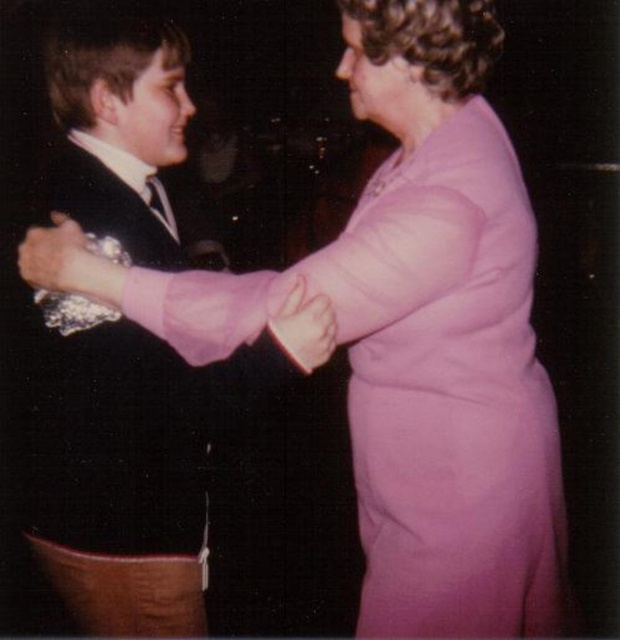
Where is `black satin suit at left`? Image resolution: width=620 pixels, height=640 pixels. black satin suit at left is located at coordinates (117, 477).

Does black satin suit at left have a greater width compared to metallic silver bracelet at upper left?

Yes.

Between point (130, 616) and point (51, 278), which one is positioned behind?

Positioned behind is point (130, 616).

Find the location of a particular element. The height and width of the screenshot is (640, 620). black satin suit at left is located at coordinates (117, 477).

Who is taller, pink satin dress at center or metallic silver bracelet at upper left?

Standing taller between the two is pink satin dress at center.

Can you confirm if pink satin dress at center is taller than metallic silver bracelet at upper left?

Yes.

What do you see at coordinates (423, 384) in the screenshot? I see `pink satin dress at center` at bounding box center [423, 384].

The image size is (620, 640). I want to click on pink satin dress at center, so click(423, 384).

Locate an element on the screen. black satin suit at left is located at coordinates (117, 477).

Is black satin suit at left bigger than matte pink sleeve at upper center?

Indeed, black satin suit at left has a larger size compared to matte pink sleeve at upper center.

Which is behind, point (56, 476) or point (290, 333)?

The point (56, 476) is behind.

The image size is (620, 640). What are the coordinates of `black satin suit at left` in the screenshot? It's located at (117, 477).